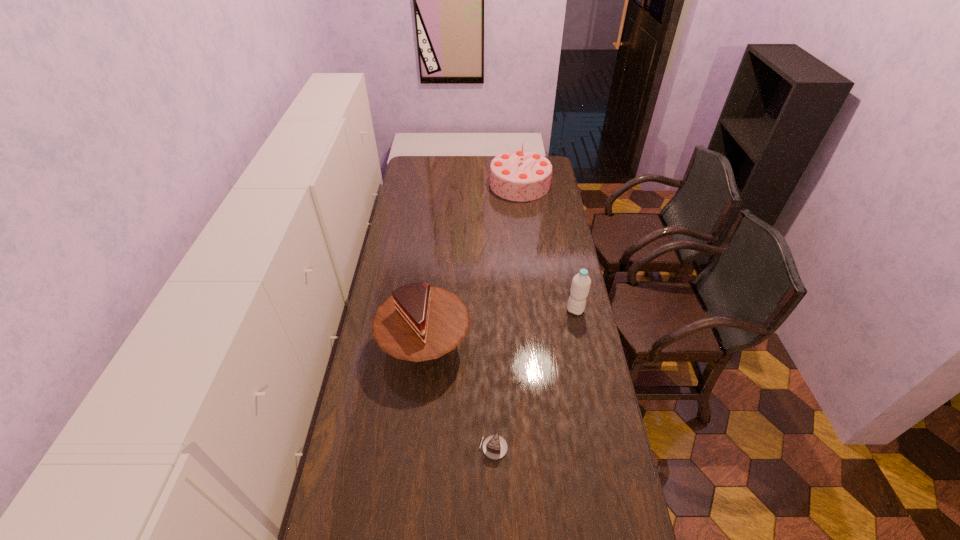
The width and height of the screenshot is (960, 540). In order to click on free space that satisfies the following two spatial constraints: 1. on the back side of the water bottle; 2. on the left side of the leftmost object in this screenshot , I will do `click(428, 310)`.

Find the location of a particular element. Image resolution: width=960 pixels, height=540 pixels. free location that satisfies the following two spatial constraints: 1. on the front side of the water bottle; 2. on the right side of the farthest object is located at coordinates (535, 310).